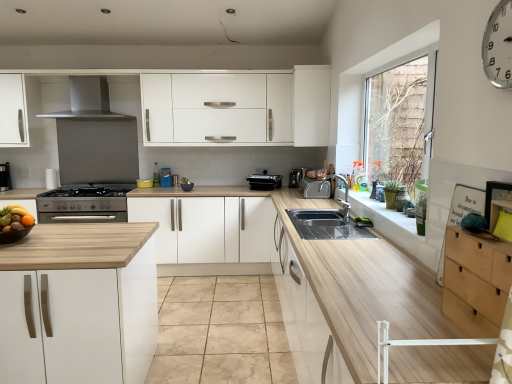
Question: From the image's perspective, would you say white matte cabinet at upper center, which appears as the 2th cabinetry when viewed from the back, is shown under satin silver stove at lower left, which is the first appliance in left-to-right order?

Choices:
 (A) yes
 (B) no

Answer: (B)

Question: Is white matte cabinet at upper center, which appears as the 2th cabinetry when viewed from the back, directly adjacent to satin silver stove at lower left, which is the first appliance in left-to-right order?

Choices:
 (A) yes
 (B) no

Answer: (B)

Question: Is white matte cabinet at upper center, acting as the third cabinetry starting from the bottom, bigger than satin silver stove at lower left, which is the first appliance in left-to-right order?

Choices:
 (A) no
 (B) yes

Answer: (B)

Question: From a real-world perspective, does white matte cabinet at upper center, which appears as the 2th cabinetry when viewed from the back, sit lower than satin silver stove at lower left, which is the first appliance in left-to-right order?

Choices:
 (A) yes
 (B) no

Answer: (B)

Question: Could you tell me if white matte cabinet at upper center, marked as the 2th cabinetry in a right-to-left arrangement, is facing satin silver stove at lower left, which is the first appliance in left-to-right order?

Choices:
 (A) no
 (B) yes

Answer: (B)

Question: Considering the positions of stainless steel exhaust hood at upper center and wooden at left in the image, is stainless steel exhaust hood at upper center wider or thinner than wooden at left?

Choices:
 (A) wide
 (B) thin

Answer: (B)

Question: Based on their positions, is stainless steel exhaust hood at upper center located to the left or right of wooden at left?

Choices:
 (A) left
 (B) right

Answer: (A)

Question: Considering their positions, is stainless steel exhaust hood at upper center located in front of or behind wooden at left?

Choices:
 (A) behind
 (B) front

Answer: (A)

Question: From their relative heights in the image, would you say stainless steel exhaust hood at upper center is taller or shorter than wooden at left?

Choices:
 (A) short
 (B) tall

Answer: (A)

Question: In terms of height, does beech wood drawer at right, which ranks as the third cabinetry in left-to-right order, look taller or shorter compared to shiny metallic bowl at left?

Choices:
 (A) short
 (B) tall

Answer: (B)

Question: From the image's perspective, is beech wood drawer at right, which appears as the 1th cabinetry when viewed from the right, positioned above or below shiny metallic bowl at left?

Choices:
 (A) above
 (B) below

Answer: (B)

Question: Looking at the image, does beech wood drawer at right, which is the 2th cabinetry from top to bottom, seem bigger or smaller compared to shiny metallic bowl at left?

Choices:
 (A) big
 (B) small

Answer: (A)

Question: Relative to shiny metallic bowl at left, is beech wood drawer at right, marked as the second cabinetry in a bottom-to-top arrangement, in front or behind?

Choices:
 (A) behind
 (B) front

Answer: (B)

Question: Is point (41, 200) closer or farther from the camera than point (78, 104)?

Choices:
 (A) closer
 (B) farther

Answer: (A)

Question: Choose the correct answer: Is satin silver stove at lower left, which is the first appliance in left-to-right order, inside stainless steel exhaust hood at upper center or outside it?

Choices:
 (A) outside
 (B) inside

Answer: (A)